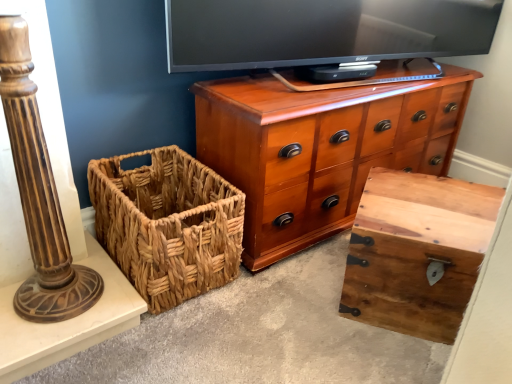
This screenshot has height=384, width=512. I want to click on vacant area on top of rustic wood trunk at center (from a real-world perspective), so click(436, 199).